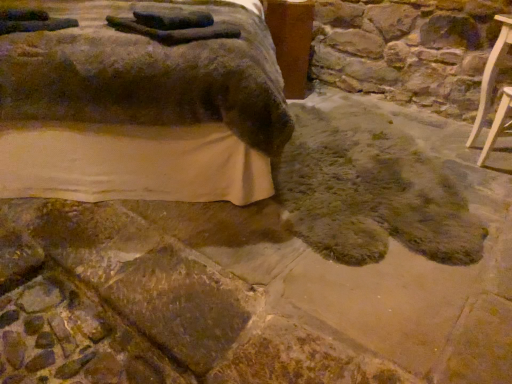
Question: From the image's perspective, relative to light wood chair at right, the 1th furniture when ordered from right to left, is brown wood table at upper center above or below?

Choices:
 (A) below
 (B) above

Answer: (B)

Question: Is brown wood table at upper center inside or outside of light wood chair at right, which is the second furniture in left-to-right order?

Choices:
 (A) outside
 (B) inside

Answer: (A)

Question: Which of these objects is positioned farthest from the brown textured mattress at lower left, acting as the first furniture starting from the left?

Choices:
 (A) fuzzy brown rug at lower center
 (B) brown wood table at upper center
 (C) light wood chair at right, the 1th furniture when ordered from right to left

Answer: (C)

Question: Which object is positioned closest to the brown textured mattress at lower left, acting as the first furniture starting from the left?

Choices:
 (A) fuzzy brown rug at lower center
 (B) light wood chair at right, the 1th furniture when ordered from right to left
 (C) brown wood table at upper center

Answer: (A)